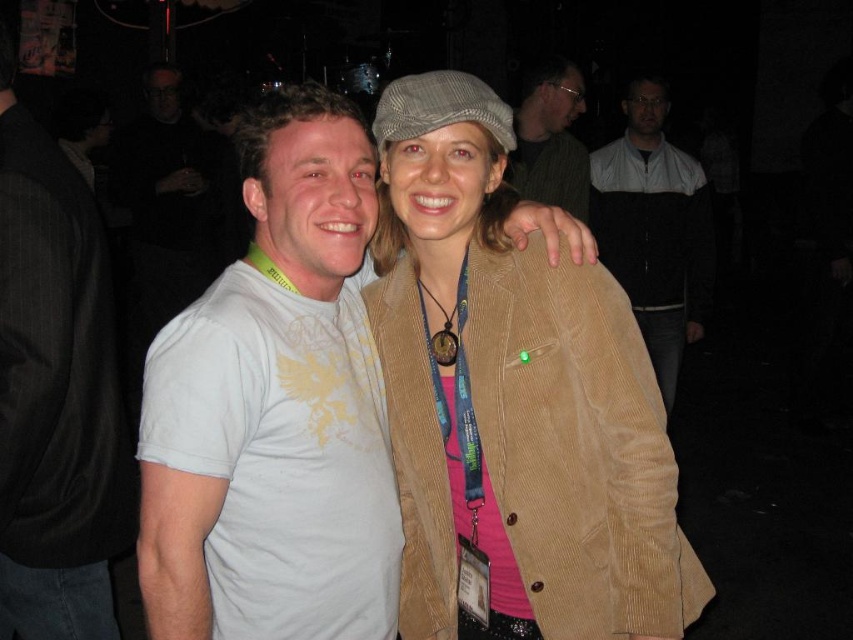
Is point (259, 301) closer to camera compared to point (78, 310)?

Yes, point (259, 301) is in front of point (78, 310).

Is white cotton t-shirt at center smaller than white cotton t-shirt at left?

No, white cotton t-shirt at center is not smaller than white cotton t-shirt at left.

Locate an element on the screen. white cotton t-shirt at center is located at coordinates (276, 408).

Does point (496, 296) come behind point (553, 166)?

No, it is not.

Identify the location of corduroy blazer at center. (514, 400).

Can you confirm if white cotton t-shirt at center is thinner than matte black jacket at upper center?

In fact, white cotton t-shirt at center might be wider than matte black jacket at upper center.

Between white cotton t-shirt at center and matte black jacket at upper center, which one appears on the right side from the viewer's perspective?

From the viewer's perspective, matte black jacket at upper center appears more on the right side.

Image resolution: width=853 pixels, height=640 pixels. I want to click on white cotton t-shirt at center, so click(x=276, y=408).